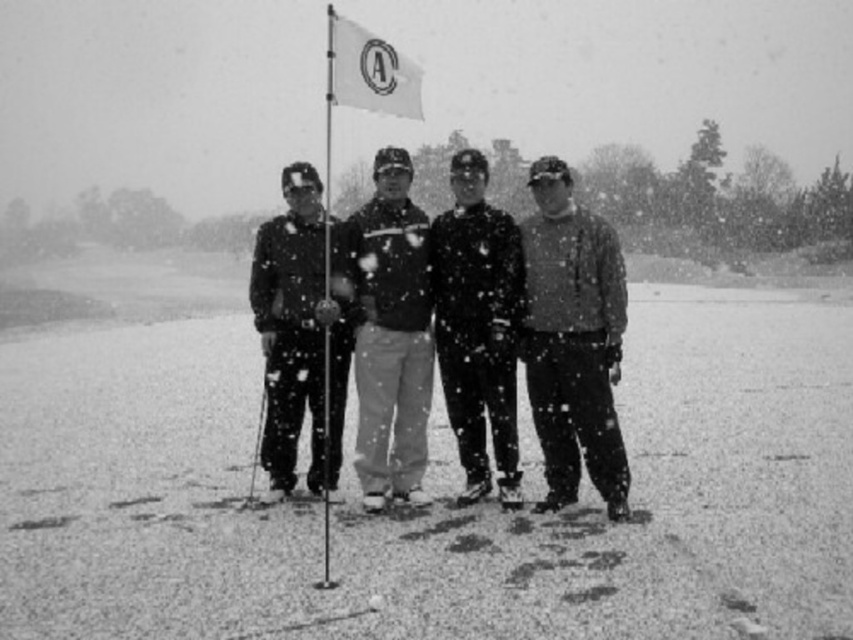
I want to click on matte gray sweater at right, so click(573, 339).

Does matte gray sweater at right have a lesser height compared to metallic ski pole at center?

In fact, matte gray sweater at right may be taller than metallic ski pole at center.

Who is more forward, (555,216) or (262,428)?

Positioned in front is point (555,216).

The height and width of the screenshot is (640, 853). I want to click on matte gray sweater at right, so click(x=573, y=339).

Find the location of a particular element. This screenshot has height=640, width=853. matte gray sweater at right is located at coordinates (573, 339).

The height and width of the screenshot is (640, 853). What do you see at coordinates (573, 339) in the screenshot?
I see `matte gray sweater at right` at bounding box center [573, 339].

Is point (561, 362) less distant than point (505, 262)?

That is True.

You are a GUI agent. You are given a task and a screenshot of the screen. Output one action in this format:
    pyautogui.click(x=<x>, y=<y>)
    Task: Click on the matte gray sweater at right
    The width and height of the screenshot is (853, 640).
    Given the screenshot: What is the action you would take?
    pyautogui.click(x=573, y=339)

Who is more distant from viewer, (381, 305) or (293, 326)?

The point (293, 326) is behind.

Image resolution: width=853 pixels, height=640 pixels. Identify the location of dark gray cotton pants at center. (390, 333).